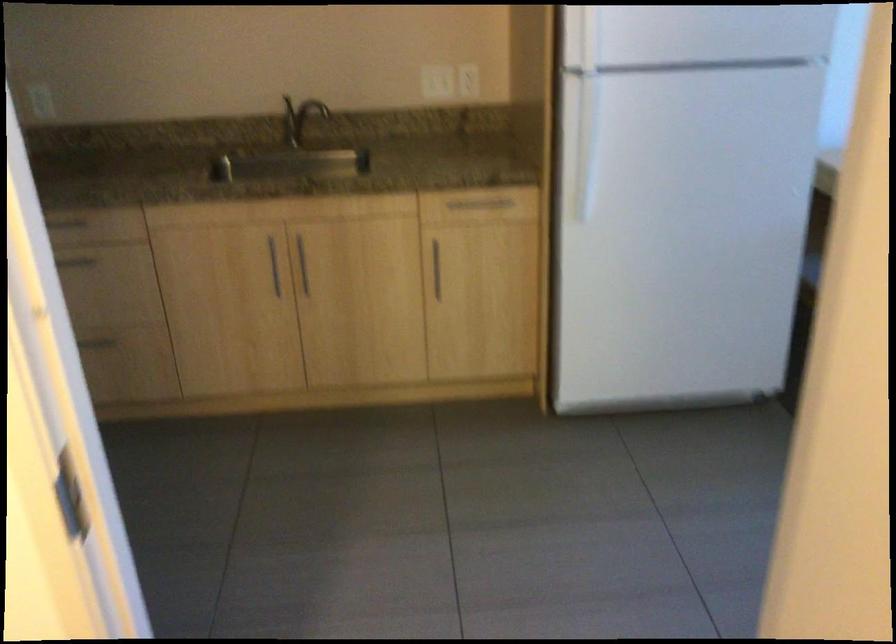
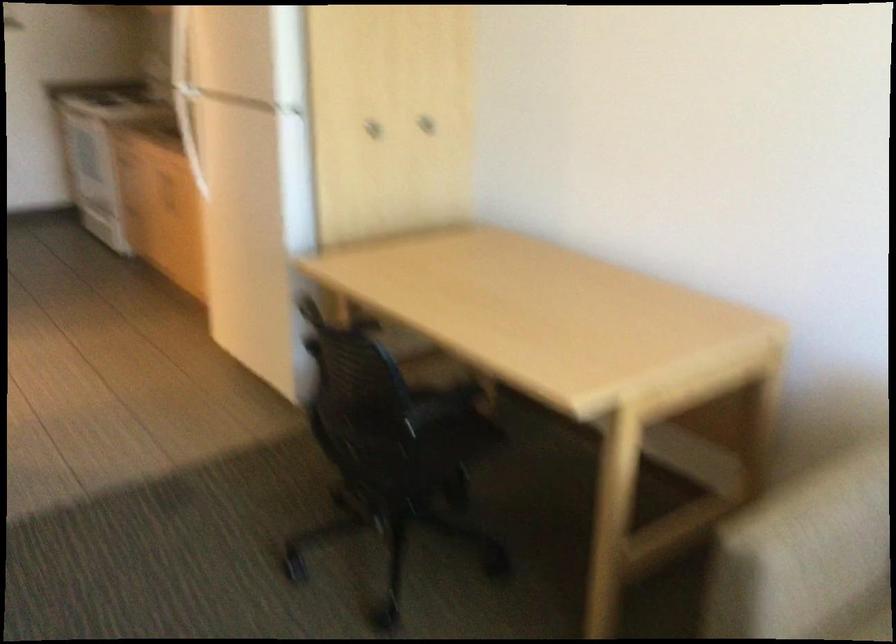
Question: I am providing you with two images of the same scene from different viewpoints. After the viewpoint changes to image2, which objects are now occluded?

Choices:
 (A) refrigerator door handle
 (B) chair sitting surface
 (C) faucet handle
 (D) yellow toy banana

Answer: (C)